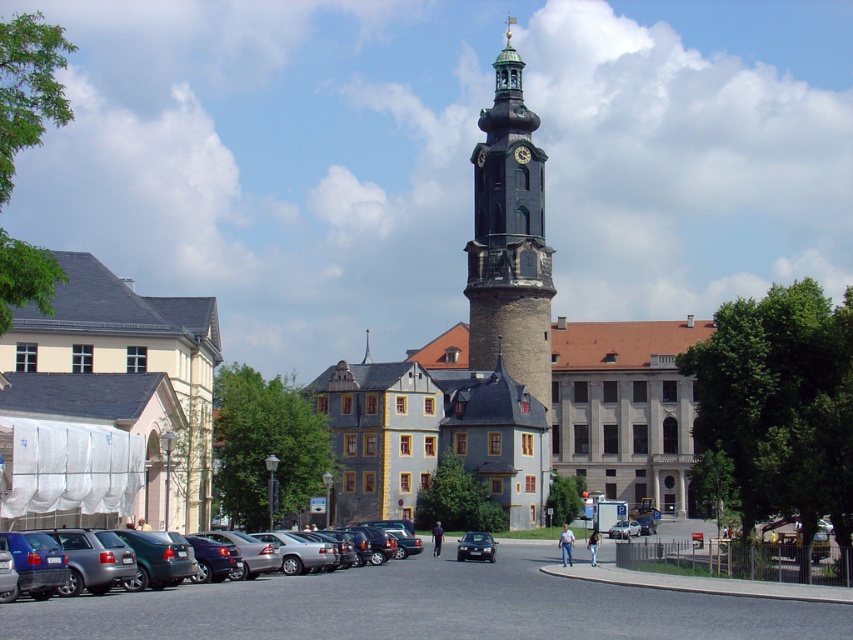
Between dark gray stone clock tower at center and silver metallic sedan at center, which one has less height?

With less height is silver metallic sedan at center.

Can you confirm if dark gray stone clock tower at center is positioned to the left of silver metallic sedan at center?

Indeed, dark gray stone clock tower at center is positioned on the left side of silver metallic sedan at center.

You are a GUI agent. You are given a task and a screenshot of the screen. Output one action in this format:
    pyautogui.click(x=<x>, y=<y>)
    Task: Click on the dark gray stone clock tower at center
    The width and height of the screenshot is (853, 640).
    Given the screenshot: What is the action you would take?
    pyautogui.click(x=509, y=237)

This screenshot has width=853, height=640. In order to click on dark gray stone clock tower at center in this screenshot , I will do `click(509, 237)`.

Describe the element at coordinates (422, 605) in the screenshot. I see `gray metallic cars at lower left` at that location.

Based on the photo, can you confirm if gray metallic cars at lower left is shorter than silver metallic sedan at center?

In fact, gray metallic cars at lower left may be taller than silver metallic sedan at center.

Which is behind, point (218, 582) or point (616, 534)?

Point (616, 534)

At what (x,y) coordinates should I click in order to perform the action: click on gray metallic cars at lower left. Please return your answer as a coordinate pair (x, y). This screenshot has width=853, height=640. Looking at the image, I should click on (422, 605).

Between gray metallic cars at lower left and beige fabric draped church at left, which one is positioned lower?

gray metallic cars at lower left is below.

Is gray metallic cars at lower left below beige fabric draped church at left?

Correct, gray metallic cars at lower left is located below beige fabric draped church at left.

Does point (503, 605) come in front of point (194, 404)?

Yes, point (503, 605) is in front of point (194, 404).

Where is `gray metallic cars at lower left`? gray metallic cars at lower left is located at coordinates (422, 605).